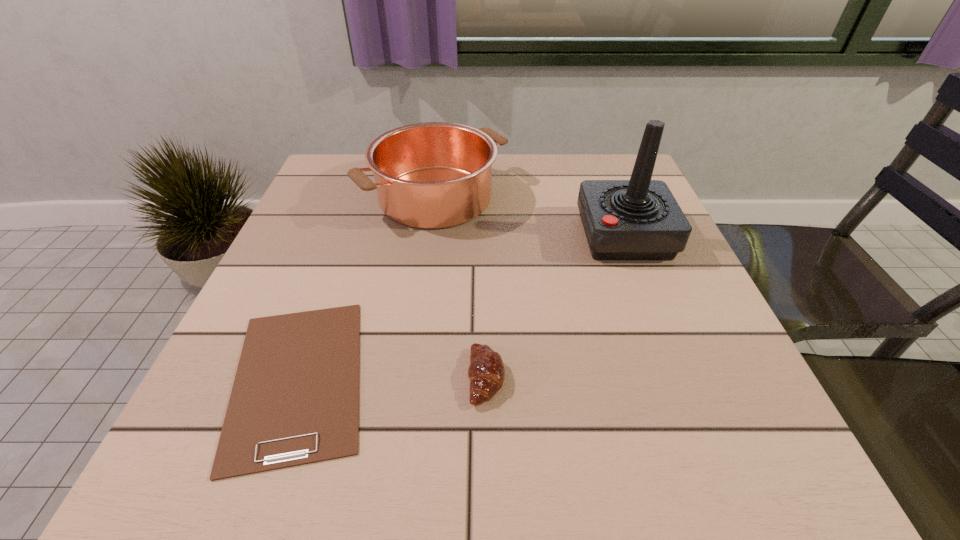
What are the coordinates of `vacant space located 0.390m on the back of the shortest object` in the screenshot? It's located at (363, 194).

I want to click on object located at the far edge, so click(432, 175).

I want to click on object located in the near edge section of the desktop, so click(x=295, y=398).

Image resolution: width=960 pixels, height=540 pixels. What are the coordinates of `saucepan that is at the left edge` in the screenshot? It's located at (432, 175).

This screenshot has height=540, width=960. I want to click on clipboard that is at the left edge, so click(295, 398).

Identify the location of object that is positioned at the right edge. The image size is (960, 540). (638, 219).

Where is `object situated at the far left corner`? The height and width of the screenshot is (540, 960). object situated at the far left corner is located at coordinates (432, 175).

The height and width of the screenshot is (540, 960). Find the location of `object at the near left corner`. object at the near left corner is located at coordinates (295, 398).

Locate an element on the screen. This screenshot has height=540, width=960. vacant region at the left edge of the desktop is located at coordinates (322, 260).

This screenshot has height=540, width=960. I want to click on vacant space at the right edge of the desktop, so click(691, 341).